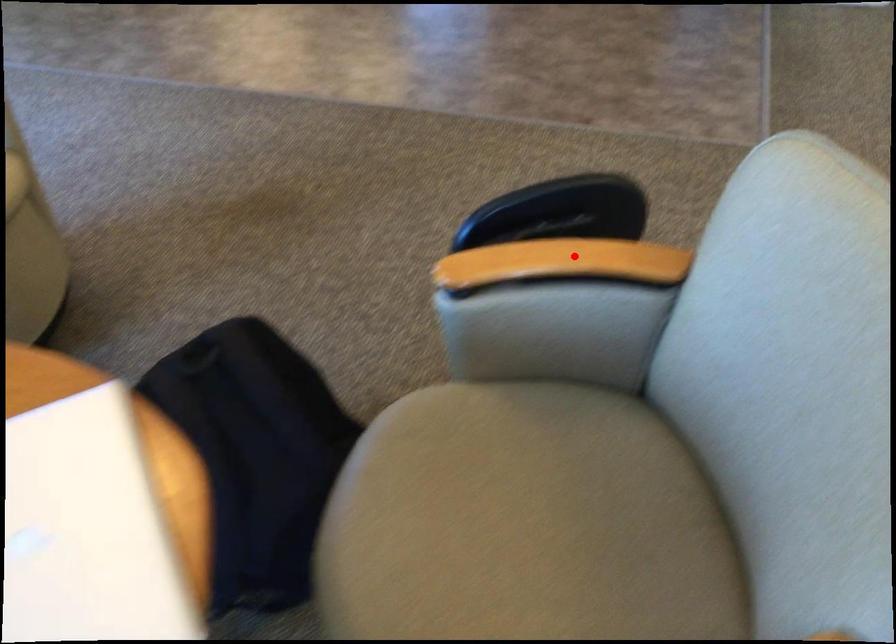
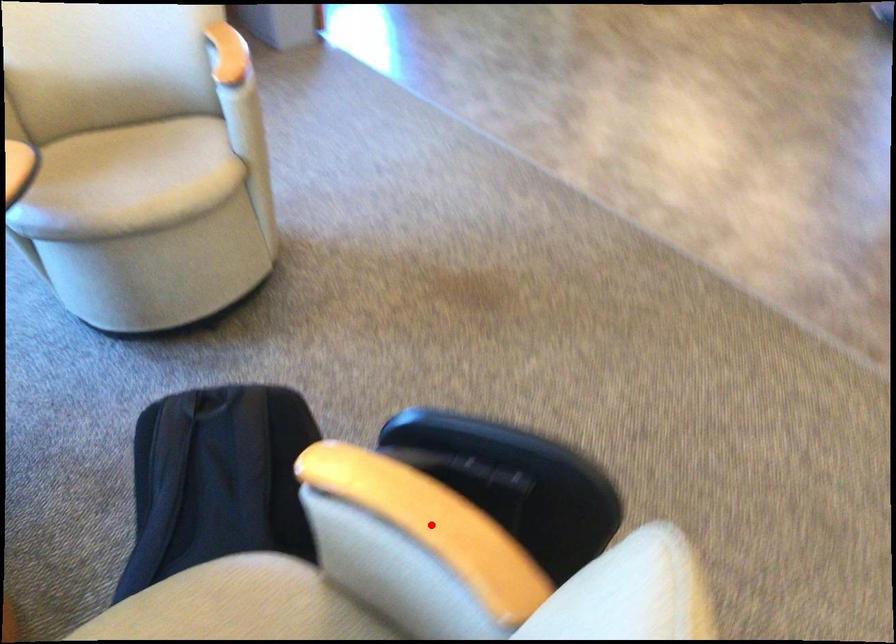
I am providing you with two images of the same scene from different viewpoints. A red point is marked on the first image and another point is marked on the second image. Does the point marked in image1 correspond to the same location as the one in image2?

Yes